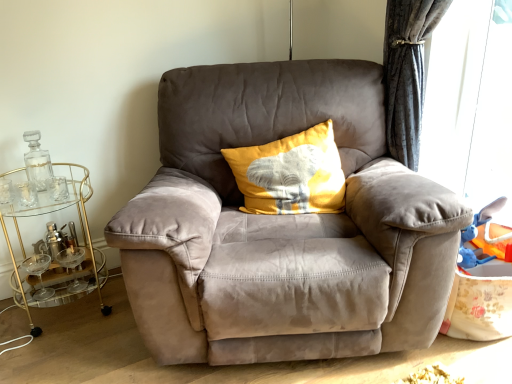
Question: Based on their sizes in the image, would you say yellow fabric pillow at center is bigger or smaller than clear glass bottle at left?

Choices:
 (A) big
 (B) small

Answer: (A)

Question: Is yellow fabric pillow at center taller or shorter than clear glass bottle at left?

Choices:
 (A) tall
 (B) short

Answer: (A)

Question: Which object is positioned closest to the gold glass bar cart at left?

Choices:
 (A) yellow fabric pillow at center
 (B) transparent plastic window screen at right
 (C) clear glass bottle at left
 (D) suede gray armchair at center

Answer: (C)

Question: Which of these objects is positioned farthest from the clear glass bottle at left?

Choices:
 (A) suede gray armchair at center
 (B) gold glass bar cart at left
 (C) yellow fabric pillow at center
 (D) transparent plastic window screen at right

Answer: (D)